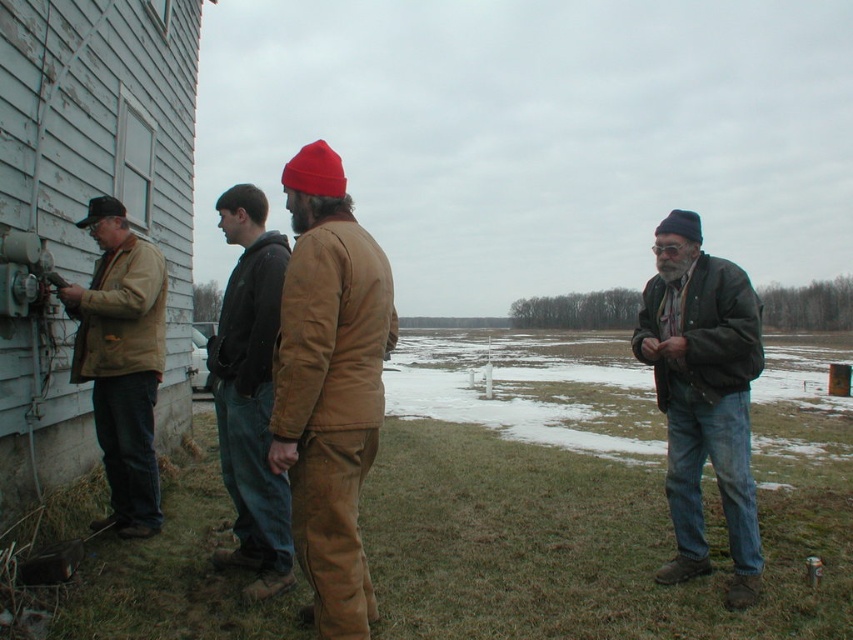
You are a photographer trying to capture a clear shot of the brown corduroy pants at center and the brown leather jacket at center. Since you want both subjects in focus, which one should you adjust your camera focus on first to ensure the closer subject is sharp?

The brown corduroy pants at center is closer to the viewer than the brown leather jacket at center. To ensure the closer subject is sharp, focus on the brown corduroy pants at center first.